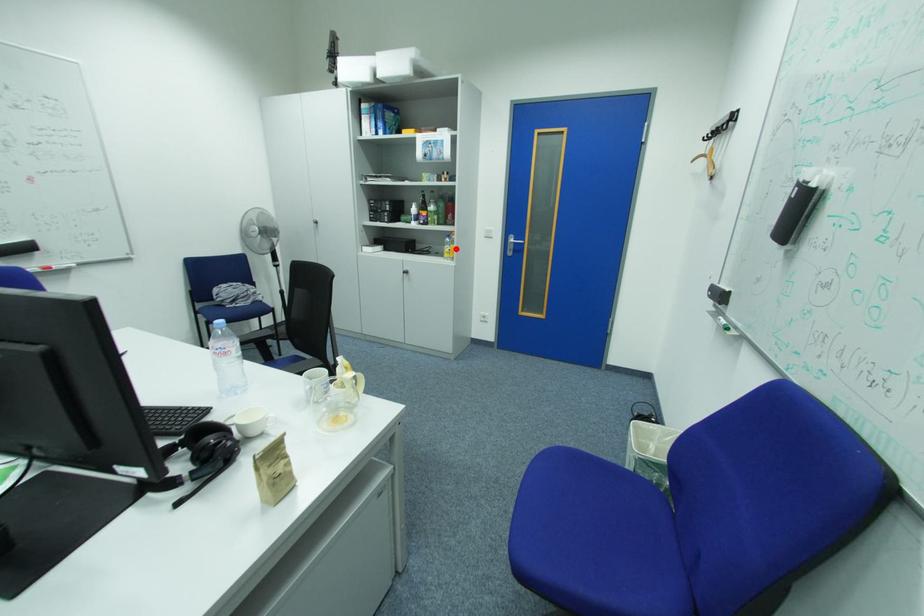
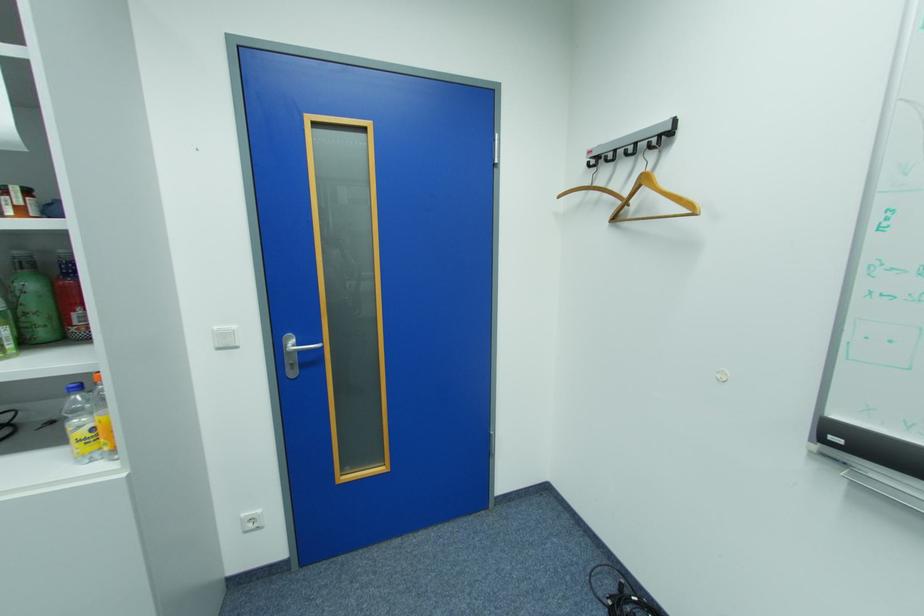
The point at the highlighted location is marked in the first image. Where is the corresponding point in the second image?

(89, 427)